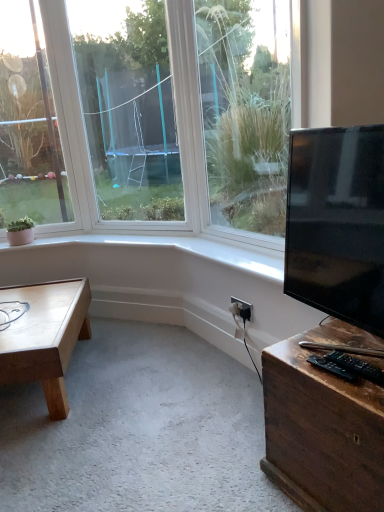
Question: Does black plastic remote control at lower right, placed as the first wide when sorted from right to left, have a greater width compared to black plastic remote control at lower right, which is counted as the first wide, starting from the left?

Choices:
 (A) yes
 (B) no

Answer: (B)

Question: Is black plastic remote control at lower right, placed as the first wide when sorted from right to left, far away from black plastic remote control at lower right, which is counted as the first wide, starting from the left?

Choices:
 (A) yes
 (B) no

Answer: (B)

Question: Is black plastic remote control at lower right, positioned as the 2th wide in left-to-right order, closer to camera compared to black plastic remote control at lower right, the 2th wide viewed from the right?

Choices:
 (A) no
 (B) yes

Answer: (B)

Question: From a real-world perspective, is black plastic remote control at lower right, placed as the first wide when sorted from right to left, beneath black plastic remote control at lower right, the 2th wide viewed from the right?

Choices:
 (A) yes
 (B) no

Answer: (B)

Question: Considering the relative sizes of black plastic remote control at lower right, placed as the first wide when sorted from right to left, and black plastic remote control at lower right, which is counted as the first wide, starting from the left, in the image provided, is black plastic remote control at lower right, placed as the first wide when sorted from right to left, thinner than black plastic remote control at lower right, which is counted as the first wide, starting from the left,?

Choices:
 (A) yes
 (B) no

Answer: (B)

Question: Looking at their shapes, would you say light brown wooden coffee table at lower left is wider or thinner than black glossy tv at right?

Choices:
 (A) thin
 (B) wide

Answer: (B)

Question: Is point (41, 356) closer or farther from the camera than point (382, 330)?

Choices:
 (A) closer
 (B) farther

Answer: (B)

Question: Considering the relative positions of light brown wooden coffee table at lower left and black glossy tv at right in the image provided, is light brown wooden coffee table at lower left to the left or to the right of black glossy tv at right?

Choices:
 (A) left
 (B) right

Answer: (A)

Question: From the image's perspective, relative to black glossy tv at right, is light brown wooden coffee table at lower left above or below?

Choices:
 (A) above
 (B) below

Answer: (B)

Question: From the image's perspective, relative to black plastic remote control at lower right, placed as the first wide when sorted from right to left, is wooden desk at lower right above or below?

Choices:
 (A) above
 (B) below

Answer: (B)

Question: In the image, is wooden desk at lower right on the left side or the right side of black plastic remote control at lower right, placed as the first wide when sorted from right to left?

Choices:
 (A) left
 (B) right

Answer: (B)

Question: Considering their positions, is wooden desk at lower right located in front of or behind black plastic remote control at lower right, positioned as the 2th wide in left-to-right order?

Choices:
 (A) behind
 (B) front

Answer: (B)

Question: Looking at their shapes, would you say wooden desk at lower right is wider or thinner than black plastic remote control at lower right, positioned as the 2th wide in left-to-right order?

Choices:
 (A) wide
 (B) thin

Answer: (A)

Question: From a real-world perspective, is black plastic remote control at lower right, the 2th wide viewed from the right, positioned above or below light brown wooden coffee table at lower left?

Choices:
 (A) above
 (B) below

Answer: (A)

Question: Relative to light brown wooden coffee table at lower left, is black plastic remote control at lower right, the 2th wide viewed from the right, in front or behind?

Choices:
 (A) behind
 (B) front

Answer: (B)